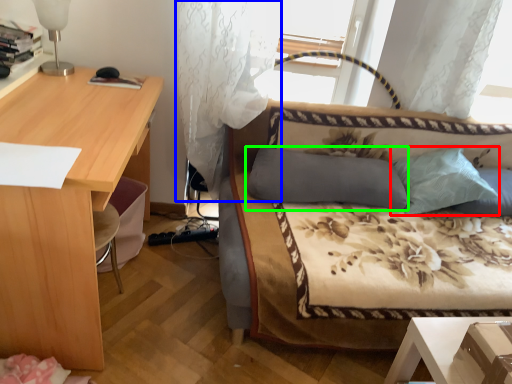
Question: Which object is positioned closest to pillow (highlighted by a red box)? Select from curtain (highlighted by a blue box) and pillow (highlighted by a green box).

Choices:
 (A) curtain
 (B) pillow

Answer: (B)